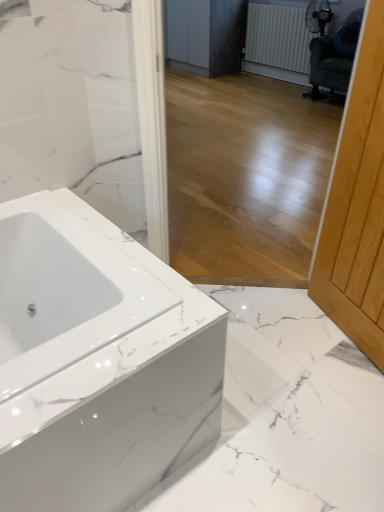
Locate an element on the screen. The height and width of the screenshot is (512, 384). light wood screen door at right is located at coordinates click(357, 206).

The image size is (384, 512). Describe the element at coordinates (278, 38) in the screenshot. I see `white textured radiator at upper right` at that location.

This screenshot has height=512, width=384. I want to click on white textured radiator at upper right, so (x=278, y=38).

Locate an element on the screen. light wood screen door at right is located at coordinates (357, 206).

Is light wood screen door at right positioned far away from white textured radiator at upper right?

light wood screen door at right is positioned a significant distance from white textured radiator at upper right.

Based on their sizes in the image, would you say light wood screen door at right is bigger or smaller than white textured radiator at upper right?

Considering their sizes, light wood screen door at right takes up less space than white textured radiator at upper right.

Which object is closer to the camera taking this photo, light wood screen door at right or white textured radiator at upper right?

light wood screen door at right is more forward.

How many degrees apart are the facing directions of light wood screen door at right and white textured radiator at upper right?

The facing directions of light wood screen door at right and white textured radiator at upper right are 18.3 degrees apart.

From a real-world perspective, is white glossy bathtub at lower left physically above dark green fabric swivel chair at upper right?

No, from a real-world perspective, white glossy bathtub at lower left is not over dark green fabric swivel chair at upper right

Does point (28, 270) appear closer or farther from the camera than point (355, 40)?

Point (28, 270) is positioned closer to the camera compared to point (355, 40).

Are white glossy bathtub at lower left and dark green fabric swivel chair at upper right located far from each other?

That's right, there is a large distance between white glossy bathtub at lower left and dark green fabric swivel chair at upper right.

Find the location of `bathtub located on the left of dark green fabric swivel chair at upper right`. bathtub located on the left of dark green fabric swivel chair at upper right is located at coordinates (97, 360).

Where is `swivel chair to the right of light wood screen door at right`? This screenshot has height=512, width=384. swivel chair to the right of light wood screen door at right is located at coordinates (332, 54).

Considering the points (320, 47) and (368, 45), which point is in front, point (320, 47) or point (368, 45)?

The point (368, 45) is in front.

From the picture: Is dark green fabric swivel chair at upper right aimed at light wood screen door at right?

No, dark green fabric swivel chair at upper right does not turn towards light wood screen door at right.

From the image's perspective, is dark green fabric swivel chair at upper right beneath light wood screen door at right?

No.

From the image's perspective, between white textured radiator at upper right and light wood screen door at right, which one is located above?

white textured radiator at upper right.

Is white textured radiator at upper right facing towards light wood screen door at right?

No, white textured radiator at upper right is not turned towards light wood screen door at right.

From a real-world perspective, between white textured radiator at upper right and light wood screen door at right, who is vertically higher?

In real-world perspective, light wood screen door at right is above.

Is dark green fabric swivel chair at upper right not within white textured radiator at upper right?

Absolutely, dark green fabric swivel chair at upper right is external to white textured radiator at upper right.

From the image's perspective, is dark green fabric swivel chair at upper right beneath white textured radiator at upper right?

Yes.

Identify the location of radiator above the dark green fabric swivel chair at upper right (from a real-world perspective). (278, 38).

Is dark green fabric swivel chair at upper right located within matte gray cabinetry at center?

Definitely not — dark green fabric swivel chair at upper right is not inside matte gray cabinetry at center.

Between matte gray cabinetry at center and dark green fabric swivel chair at upper right, which one appears on the left side from the viewer's perspective?

matte gray cabinetry at center.

Could you tell me if matte gray cabinetry at center is turned towards dark green fabric swivel chair at upper right?

No, matte gray cabinetry at center is not aimed at dark green fabric swivel chair at upper right.

Locate an element on the screen. The height and width of the screenshot is (512, 384). cabinetry below the dark green fabric swivel chair at upper right (from a real-world perspective) is located at coordinates (205, 35).

Measure the distance from dark green fabric swivel chair at upper right to white glossy bathtub at lower left.

A distance of 3.64 meters exists between dark green fabric swivel chair at upper right and white glossy bathtub at lower left.

Where is `swivel chair to the right of white glossy bathtub at lower left`? swivel chair to the right of white glossy bathtub at lower left is located at coordinates (332, 54).

Is dark green fabric swivel chair at upper right aimed at white glossy bathtub at lower left?

No, dark green fabric swivel chair at upper right is not turned towards white glossy bathtub at lower left.

What's the angular difference between dark green fabric swivel chair at upper right and white glossy bathtub at lower left's facing directions?

88 degrees separate the facing orientations of dark green fabric swivel chair at upper right and white glossy bathtub at lower left.

The image size is (384, 512). Identify the location of screen door in front of the white textured radiator at upper right. (357, 206).

Find the location of a particular element. swivel chair that is above the white glossy bathtub at lower left (from a real-world perspective) is located at coordinates (332, 54).

Considering their positions, is white textured radiator at upper right positioned further to light wood screen door at right than white glossy bathtub at lower left?

Based on the image, white textured radiator at upper right appears to be further to light wood screen door at right.

Estimate the real-world distances between objects in this image. Which object is closer to white textured radiator at upper right, light wood screen door at right or matte gray cabinetry at center?

Among the two, matte gray cabinetry at center is located nearer to white textured radiator at upper right.

When comparing their distances from dark green fabric swivel chair at upper right, does white glossy bathtub at lower left or matte gray cabinetry at center seem further?

Among the two, white glossy bathtub at lower left is located further to dark green fabric swivel chair at upper right.

When comparing their distances from dark green fabric swivel chair at upper right, does light wood screen door at right or white textured radiator at upper right seem closer?

white textured radiator at upper right.

Considering their positions, is light wood screen door at right positioned closer to dark green fabric swivel chair at upper right than white glossy bathtub at lower left?

The object closer to dark green fabric swivel chair at upper right is light wood screen door at right.

Based on their spatial positions, is dark green fabric swivel chair at upper right or white glossy bathtub at lower left further from white textured radiator at upper right?

white glossy bathtub at lower left.

When comparing their distances from dark green fabric swivel chair at upper right, does white glossy bathtub at lower left or white textured radiator at upper right seem closer?

white textured radiator at upper right lies closer to dark green fabric swivel chair at upper right than the other object.

Looking at this image, when comparing their distances from light wood screen door at right, does white glossy bathtub at lower left or white textured radiator at upper right seem further?

Among the two, white textured radiator at upper right is located further to light wood screen door at right.

Locate an element on the screen. radiator positioned between light wood screen door at right and matte gray cabinetry at center from near to far is located at coordinates (278, 38).

Locate an element on the screen. The image size is (384, 512). swivel chair between light wood screen door at right and matte gray cabinetry at center from front to back is located at coordinates tap(332, 54).

The height and width of the screenshot is (512, 384). What are the coordinates of `screen door located between white glossy bathtub at lower left and dark green fabric swivel chair at upper right in the depth direction` in the screenshot? It's located at click(357, 206).

Identify the location of swivel chair between white glossy bathtub at lower left and white textured radiator at upper right from front to back. The image size is (384, 512). (332, 54).